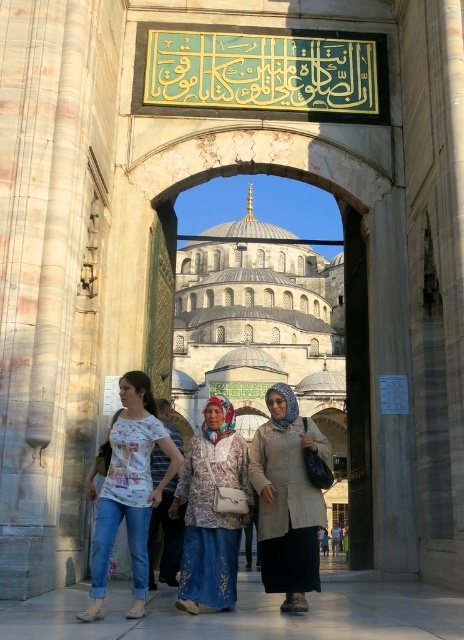
Does printed cotton dress at center have a greater height compared to denim skirt at center?

Yes, printed cotton dress at center is taller than denim skirt at center.

Is printed cotton dress at center below denim skirt at center?

Actually, printed cotton dress at center is above denim skirt at center.

Who is more distant from viewer, (199, 484) or (335, 541)?

Point (335, 541)

Identify the location of printed cotton dress at center. The height and width of the screenshot is (640, 464). (212, 509).

Is point (216, 595) less distant than point (161, 522)?

Yes, point (216, 595) is in front of point (161, 522).

Can you confirm if printed cotton dress at center is thinner than floral printed shirt at center?

Incorrect, printed cotton dress at center's width is not less than floral printed shirt at center's.

Who is more distant from viewer, (199, 454) or (169, 540)?

The point (169, 540) is more distant.

The height and width of the screenshot is (640, 464). Find the location of `printed cotton dress at center`. printed cotton dress at center is located at coordinates (212, 509).

Can you confirm if beige woolen cardigan at center is wider than denim skirt at center?

Yes, beige woolen cardigan at center is wider than denim skirt at center.

Who is higher up, beige woolen cardigan at center or denim skirt at center?

Positioned higher is beige woolen cardigan at center.

You are a GUI agent. You are given a task and a screenshot of the screen. Output one action in this format:
    pyautogui.click(x=<x>, y=<y>)
    Task: Click on the beige woolen cardigan at center
    Image resolution: width=464 pixels, height=640 pixels.
    Given the screenshot: What is the action you would take?
    pyautogui.click(x=288, y=499)